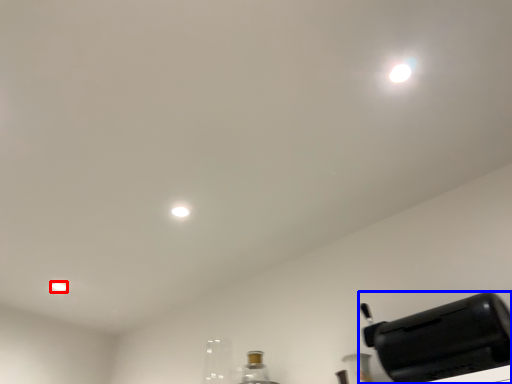
Question: Which of the following is the farthest to the observer, dot (highlighted by a red box) or home appliance (highlighted by a blue box)?

Choices:
 (A) dot
 (B) home appliance

Answer: (A)